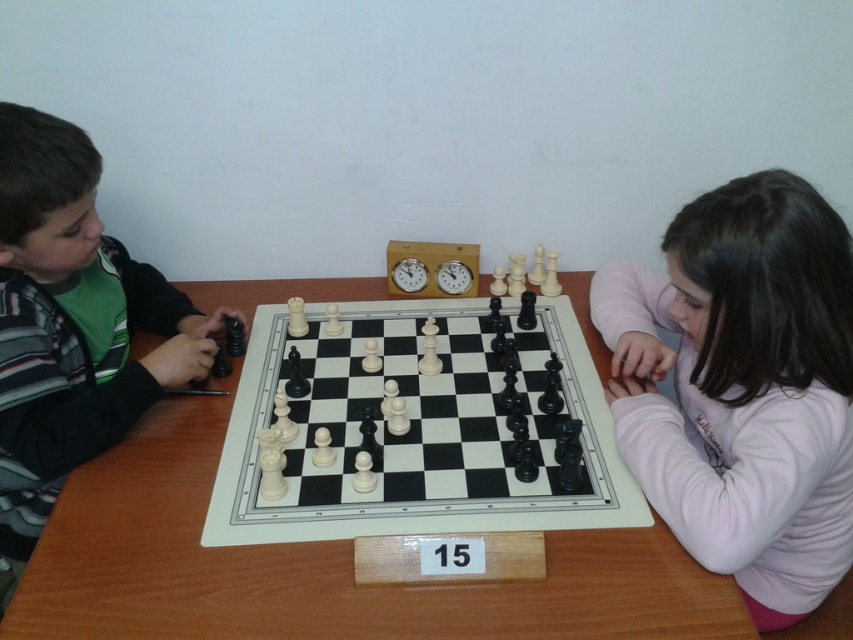
Does point (596, 362) come in front of point (338, 442)?

No, (596, 362) is behind (338, 442).

Is white wooden table at center wider than white plastic chess pieces at center?

Indeed, white wooden table at center has a greater width compared to white plastic chess pieces at center.

Who is more distant from viewer, (596, 557) or (364, 332)?

The point (364, 332) is behind.

Identify the location of white wooden table at center. (317, 566).

What do you see at coordinates (71, 324) in the screenshot? I see `striped fleece jacket at left` at bounding box center [71, 324].

Who is lower down, striped fleece jacket at left or white plastic chess pieces at center?

white plastic chess pieces at center is below.

Image resolution: width=853 pixels, height=640 pixels. Identify the location of striped fleece jacket at left. (71, 324).

Does point (693, 326) lie in front of point (445, 432)?

Yes, point (693, 326) is closer to viewer.

Is point (770, 179) behind point (474, 376)?

No, it is not.

This screenshot has height=640, width=853. I want to click on light pink fleece at right, so click(x=743, y=387).